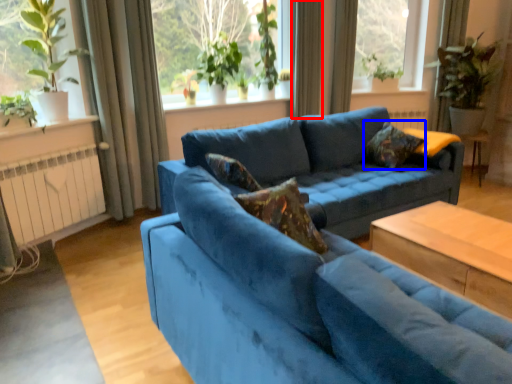
Question: Which point is closer to the camera, curtain (highlighted by a red box) or pillow (highlighted by a blue box)?

Choices:
 (A) curtain
 (B) pillow

Answer: (B)